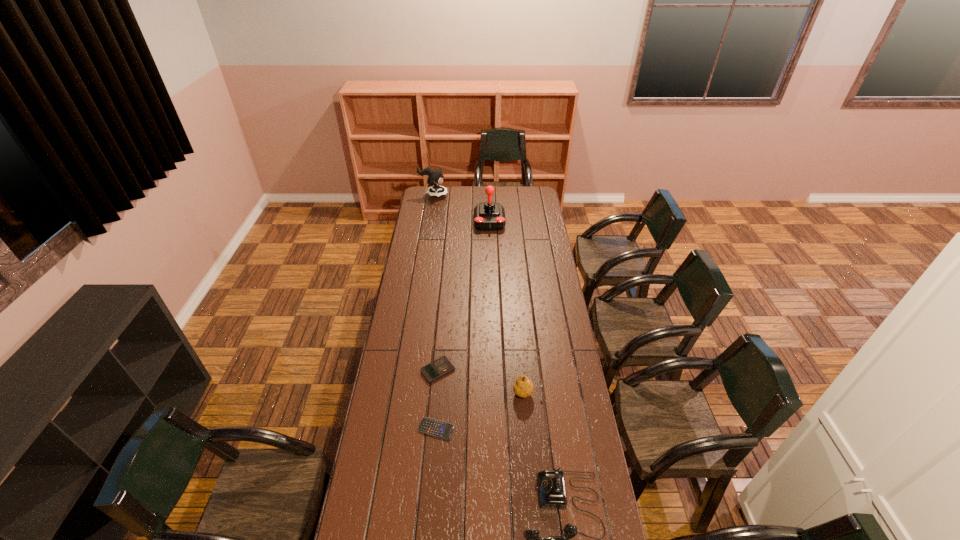
Image resolution: width=960 pixels, height=540 pixels. Find the location of `vacant area that lies between the third nearest object and the taller calculator`. vacant area that lies between the third nearest object and the taller calculator is located at coordinates (483, 382).

Identify the location of empty location between the nearer calculator and the pear. (482, 411).

The image size is (960, 540). Identify the location of free spot between the joystick and the doll. (462, 208).

At what (x,y) coordinates should I click in order to perform the action: click on vacant space that is in between the second farthest object and the pear. Please return your answer as a coordinate pair (x, y). Image resolution: width=960 pixels, height=540 pixels. Looking at the image, I should click on (508, 307).

This screenshot has width=960, height=540. I want to click on vacant area that lies between the second farthest object and the pear, so click(x=508, y=307).

Where is `free spot between the fifth nearest object and the third nearest object`? The image size is (960, 540). free spot between the fifth nearest object and the third nearest object is located at coordinates pyautogui.click(x=508, y=307).

Find the location of a particular element. free space between the shorter calculator and the second farthest object is located at coordinates (464, 325).

Identify the location of free spot between the farther calculator and the doll. The height and width of the screenshot is (540, 960). (436, 282).

In order to click on free space that is in between the doll and the shortest object in this screenshot , I will do `click(435, 312)`.

Locate an element on the screen. This screenshot has width=960, height=540. object that is the third nearest to the nearest object is located at coordinates (442, 366).